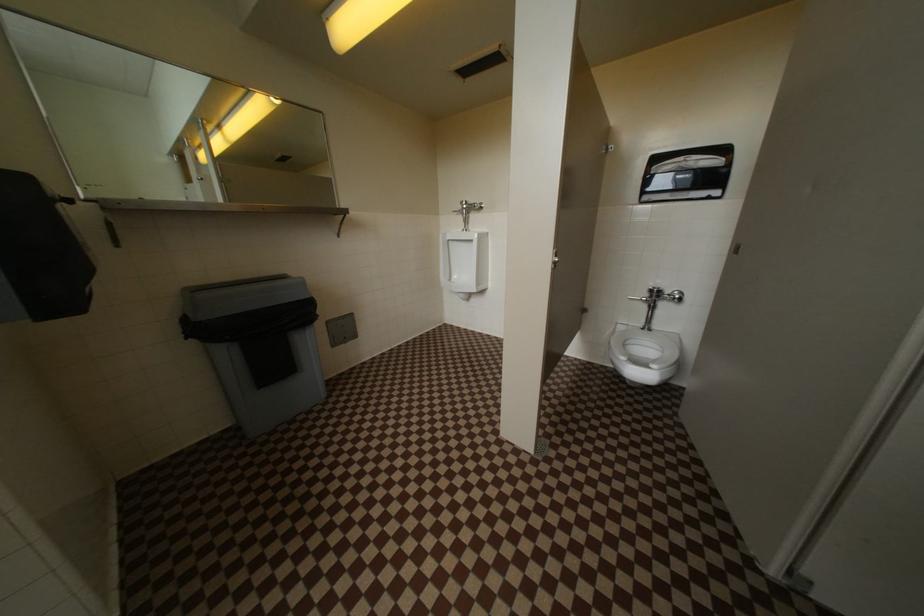
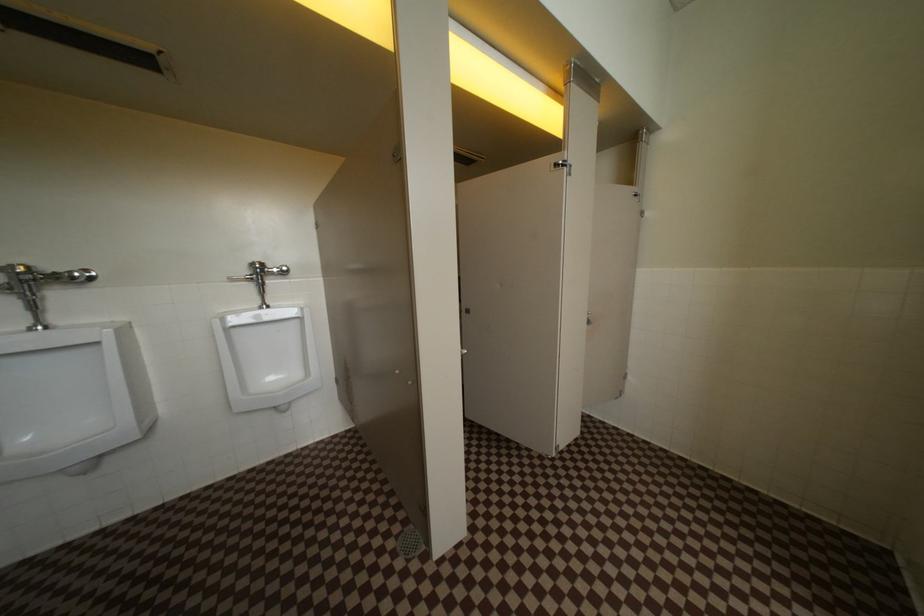
Question: The camera is either moving clockwise (left) or counter-clockwise (right) around the object. The first image is from the beginning of the video and the second image is from the end. Is the camera moving left or right when shooting the video?

Choices:
 (A) Left
 (B) Right

Answer: (A)